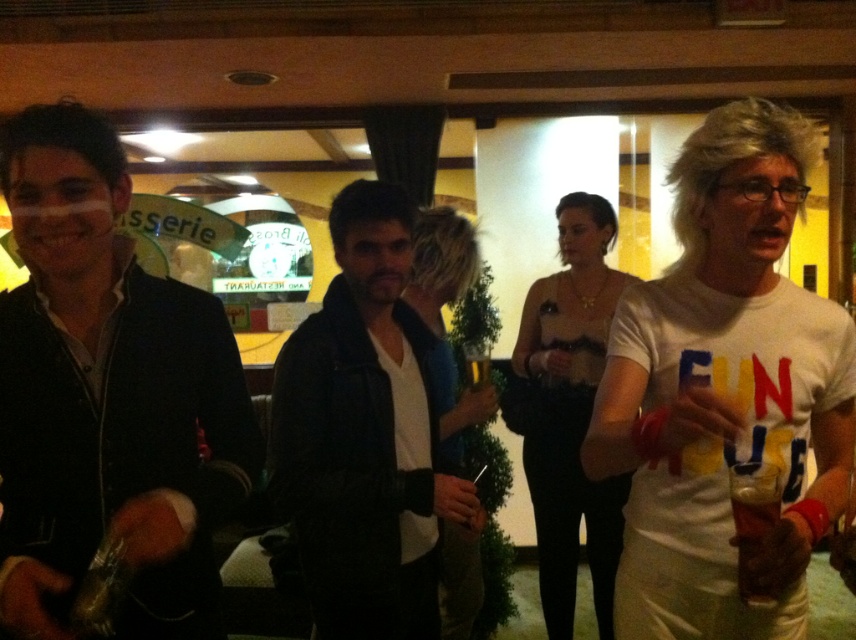
Can you confirm if white cotton t-shirt at center is positioned to the right of matte black jacket at left?

Yes, white cotton t-shirt at center is to the right of matte black jacket at left.

Between white cotton t-shirt at center and matte black jacket at left, which one has more height?

Standing taller between the two is white cotton t-shirt at center.

Does point (623, 620) lie behind point (96, 228)?

Yes.

The height and width of the screenshot is (640, 856). Find the location of `white cotton t-shirt at center`. white cotton t-shirt at center is located at coordinates (724, 390).

Does dark blue denim jacket at center have a lesser height compared to translucent glass at right?

Incorrect, dark blue denim jacket at center's height does not fall short of translucent glass at right's.

Is dark blue denim jacket at center closer to the viewer compared to translucent glass at right?

No.

At what (x,y) coordinates should I click in order to perform the action: click on dark blue denim jacket at center. Please return your answer as a coordinate pair (x, y). Image resolution: width=856 pixels, height=640 pixels. Looking at the image, I should click on (366, 435).

In order to click on dark blue denim jacket at center in this screenshot , I will do [366, 435].

Between white cotton t-shirt at center and dark blue denim jacket at center, which one appears on the left side from the viewer's perspective?

From the viewer's perspective, dark blue denim jacket at center appears more on the left side.

Does white cotton t-shirt at center appear under dark blue denim jacket at center?

No.

Image resolution: width=856 pixels, height=640 pixels. What do you see at coordinates (724, 390) in the screenshot?
I see `white cotton t-shirt at center` at bounding box center [724, 390].

Locate an element on the screen. The width and height of the screenshot is (856, 640). white cotton t-shirt at center is located at coordinates (724, 390).